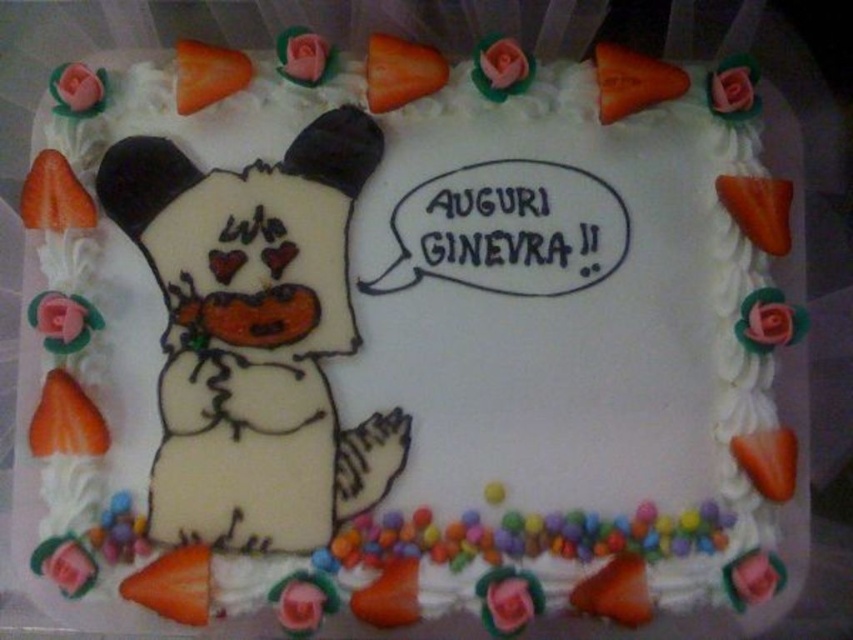
From the picture: You are a cake decorator trying to place a new decoration on the cake. You have two points marked on the cake where you can place it. The first point is at coordinates point (187, 566) and the second point is at coordinates point (97, 424). If you want to place the decoration closer to the viewer, which point should you choose?

Point (187, 566) is in front of point (97, 424), so you should choose point (187, 566) to place the decoration closer to the viewer.

You are a baker who wants to place a cherry exactly at the center of the cake. The orange matte carrot at lower left is located at coordinate point 0.914, 0.204. If the cake is a rectangle with coordinates from 0 to 1 on both axes, where should you place the cherry?

The center of the cake would be at coordinate point (x=426, y=320). Therefore, you should place the cherry at point (x=426, y=320).

Looking at the cake decorations, where is the white fondant snowman at center in relation to the orange matte carrot at upper left?

The white fondant snowman at center is to the right of the orange matte carrot at upper left.